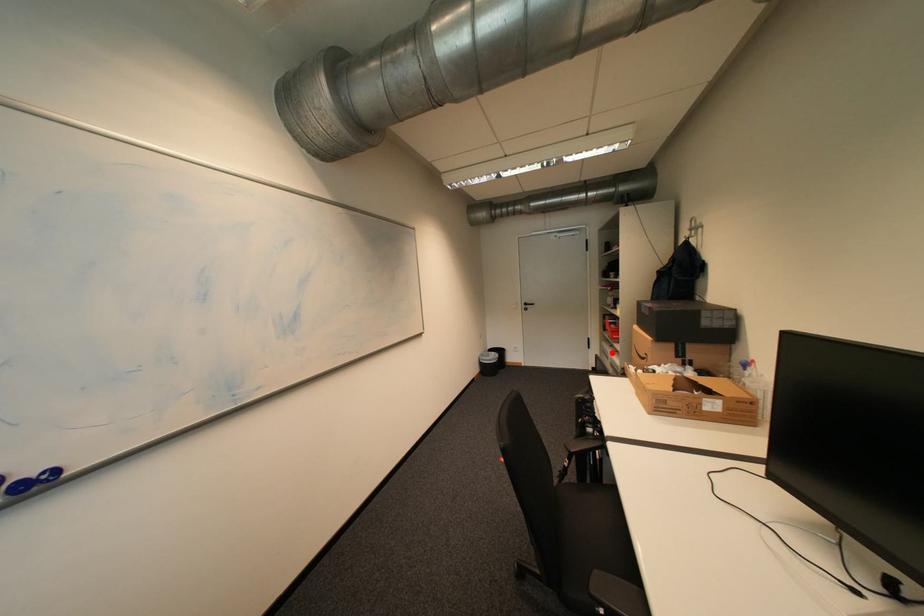
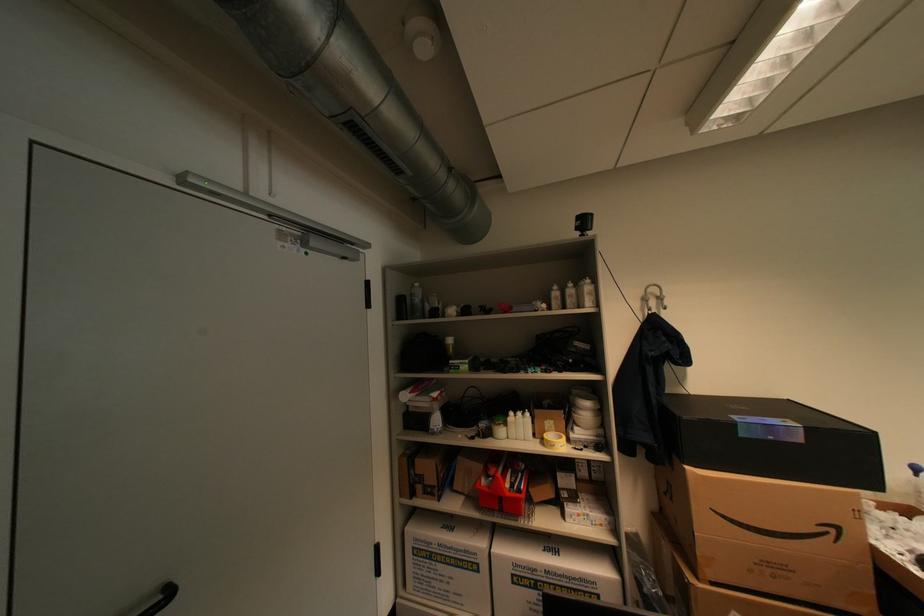
In the second image, find the point that corresponds to the highlighted location in the first image.

(439, 556)